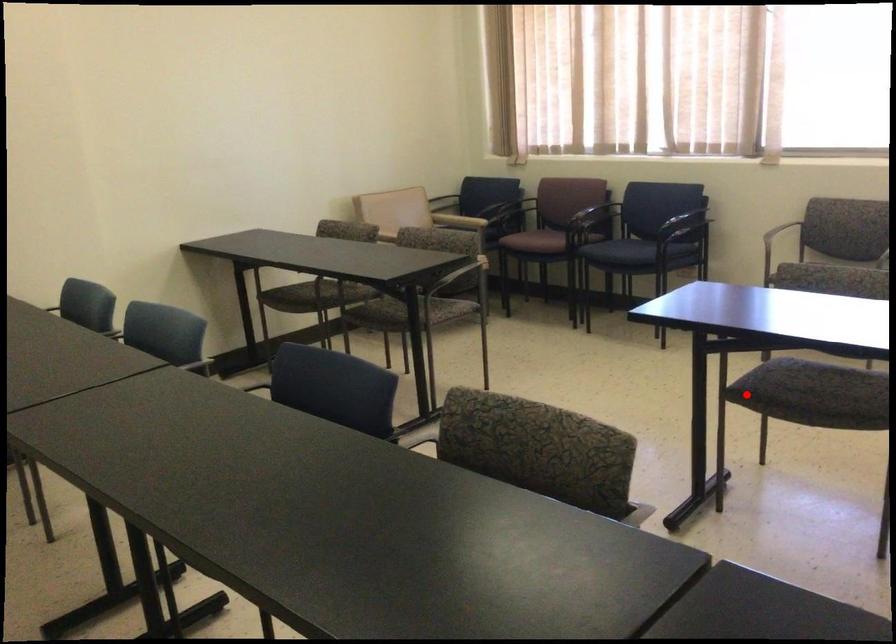
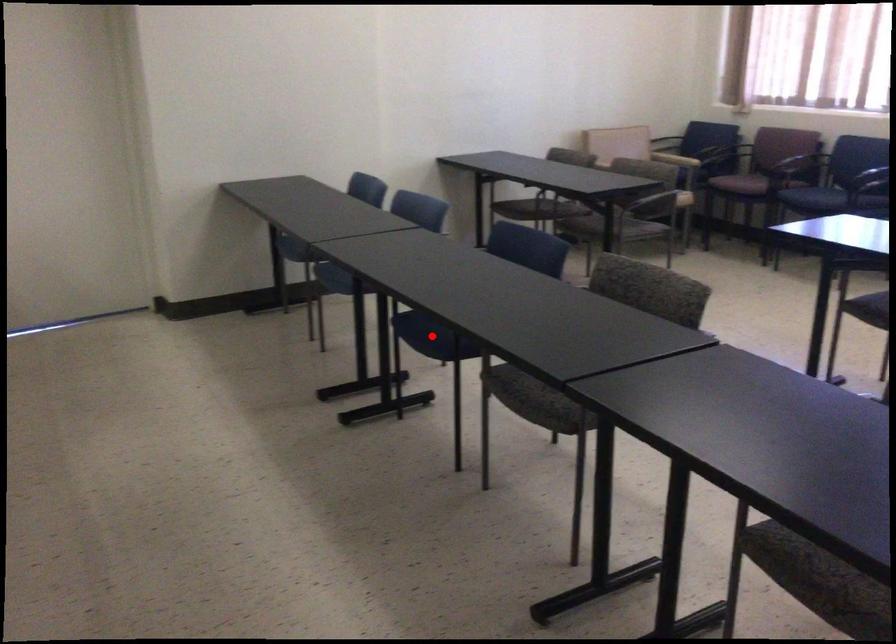
I am providing you with two images of the same scene from different viewpoints. A red point is marked on the first image and another point is marked on the second image. Do the highlighted points in image1 and image2 indicate the same real-world spot?

No